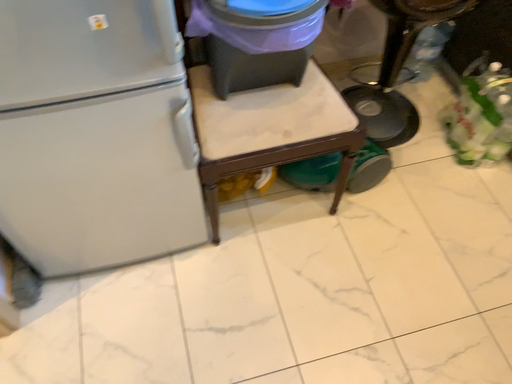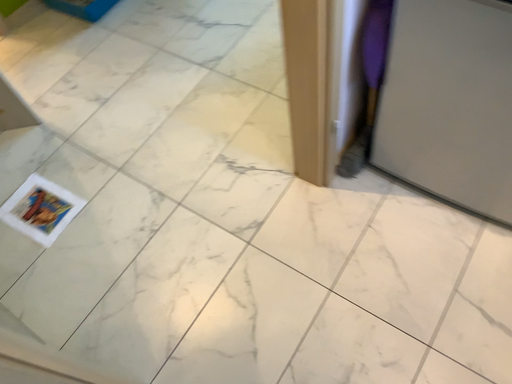
Question: Which way did the camera rotate in the video?

Choices:
 (A) rotated right
 (B) rotated left

Answer: (B)